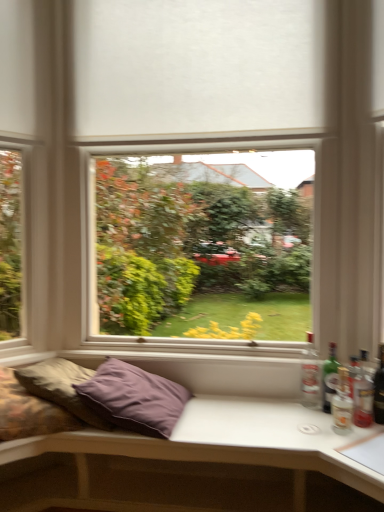
Identify the location of vacant space situated on the left part of translucent glass bottle at right, the first bottle viewed from the right. (313, 425).